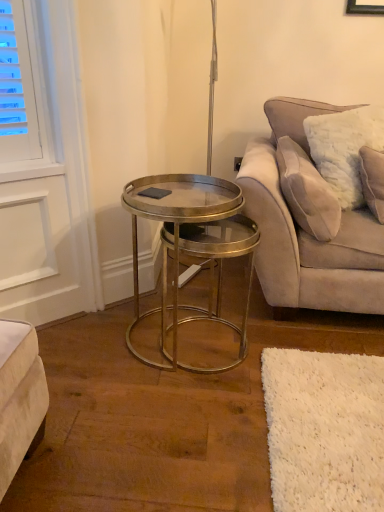
Question: Does white fluffy pillow at upper right have a greater width compared to metallic/glass coffee table at center?

Choices:
 (A) no
 (B) yes

Answer: (A)

Question: Is white fluffy pillow at upper right shorter than metallic/glass coffee table at center?

Choices:
 (A) no
 (B) yes

Answer: (B)

Question: From a real-world perspective, does white fluffy pillow at upper right sit lower than metallic/glass coffee table at center?

Choices:
 (A) no
 (B) yes

Answer: (A)

Question: Considering the relative sizes of white fluffy pillow at upper right and metallic/glass coffee table at center in the image provided, is white fluffy pillow at upper right smaller than metallic/glass coffee table at center?

Choices:
 (A) no
 (B) yes

Answer: (B)

Question: Is white fluffy pillow at upper right behind metallic/glass coffee table at center?

Choices:
 (A) yes
 (B) no

Answer: (A)

Question: From the image's perspective, relative to white fluffy pillow at upper right, is metallic/glass coffee table at center above or below?

Choices:
 (A) above
 (B) below

Answer: (B)

Question: Is point (160, 206) closer or farther from the camera than point (301, 223)?

Choices:
 (A) farther
 (B) closer

Answer: (B)

Question: Which is correct: metallic/glass coffee table at center is inside white fluffy pillow at upper right, or outside of it?

Choices:
 (A) inside
 (B) outside

Answer: (B)

Question: In terms of width, does metallic/glass coffee table at center look wider or thinner when compared to white fluffy pillow at upper right?

Choices:
 (A) thin
 (B) wide

Answer: (B)

Question: Based on their positions, is velvet beige couch at right located to the left or right of metallic/glass coffee table at center?

Choices:
 (A) left
 (B) right

Answer: (B)

Question: From the image's perspective, is velvet beige couch at right positioned above or below metallic/glass coffee table at center?

Choices:
 (A) below
 (B) above

Answer: (B)

Question: Based on their sizes in the image, would you say velvet beige couch at right is bigger or smaller than metallic/glass coffee table at center?

Choices:
 (A) small
 (B) big

Answer: (B)

Question: Do you think velvet beige couch at right is within metallic/glass coffee table at center, or outside of it?

Choices:
 (A) outside
 (B) inside

Answer: (A)

Question: Considering the positions of point (160, 365) and point (294, 97), is point (160, 365) closer or farther from the camera than point (294, 97)?

Choices:
 (A) closer
 (B) farther

Answer: (A)

Question: Considering the positions of metallic/glass coffee table at center and velvet beige couch at right in the image, is metallic/glass coffee table at center wider or thinner than velvet beige couch at right?

Choices:
 (A) wide
 (B) thin

Answer: (B)